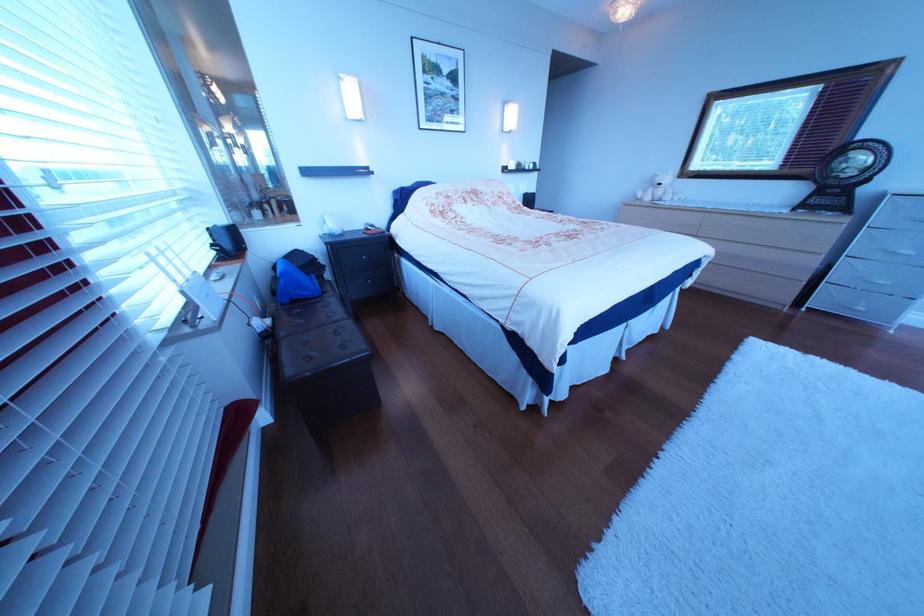
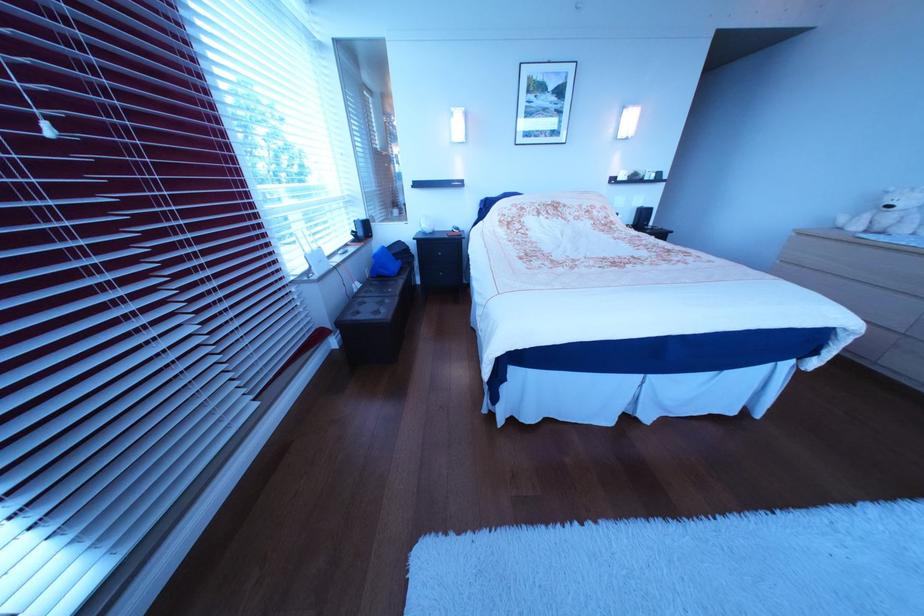
Question: The camera is either moving clockwise (left) or counter-clockwise (right) around the object. The first image is from the beginning of the video and the second image is from the end. Is the camera moving left or right when shooting the video?

Choices:
 (A) Left
 (B) Right

Answer: (B)